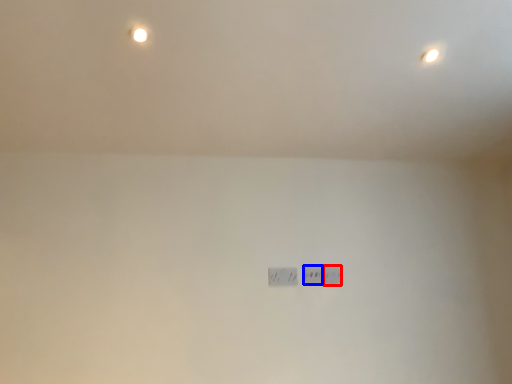
Question: Among these objects, which one is nearest to the camera, power plugs and sockets (highlighted by a red box) or power plugs and sockets (highlighted by a blue box)?

Choices:
 (A) power plugs and sockets
 (B) power plugs and sockets

Answer: (B)